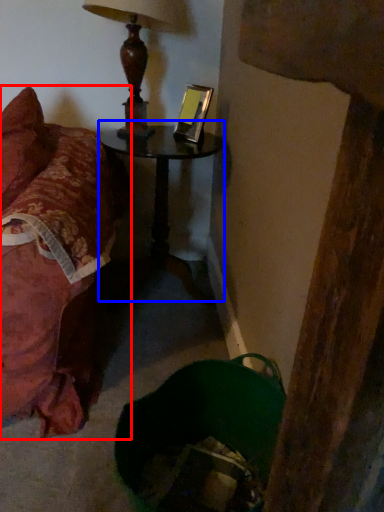
Question: Which point is closer to the camera, furniture (highlighted by a red box) or table (highlighted by a blue box)?

Choices:
 (A) furniture
 (B) table

Answer: (A)